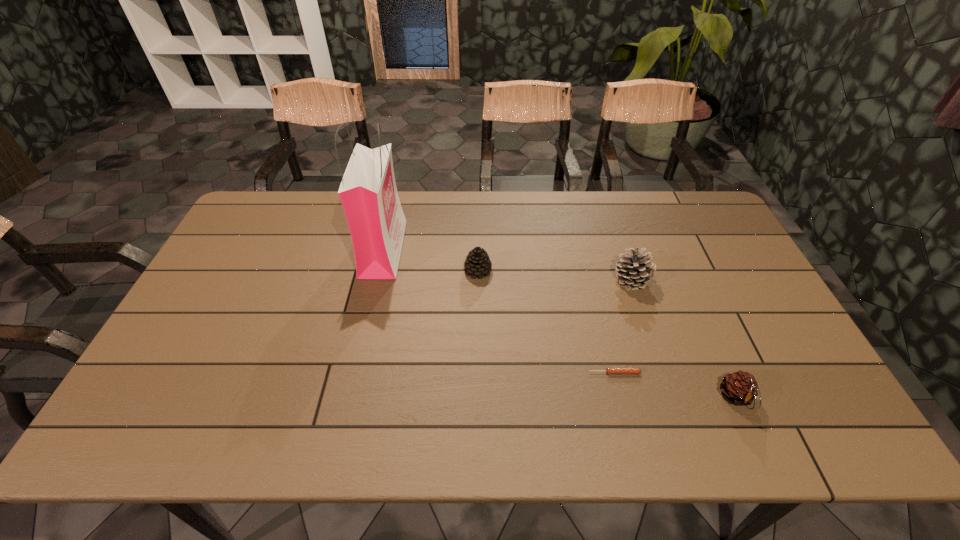
The height and width of the screenshot is (540, 960). What are the coordinates of `the third closest object to the leftmost pinecone` in the screenshot? It's located at (609, 370).

Select which pinecone appears as the closest to the shopping bag. Please provide its 2D coordinates. Your answer should be formatted as a tuple, i.e. [(x, y)], where the tuple contains the x and y coordinates of a point satisfying the conditions above.

[(477, 264)]

Identify which pinecone is located as the nearest to the leftmost pinecone. Please provide its 2D coordinates. Your answer should be formatted as a tuple, i.e. [(x, y)], where the tuple contains the x and y coordinates of a point satisfying the conditions above.

[(634, 269)]

Locate an element on the screen. The width and height of the screenshot is (960, 540). free spot that satisfies the following two spatial constraints: 1. at the narrow end of the fourth object from right to left; 2. on the left side of the second nearest object is located at coordinates (477, 373).

At what (x,y) coordinates should I click in order to perform the action: click on vacant space that satisfies the following two spatial constraints: 1. on the front-facing side of the sausage; 2. on the right side of the shopping bag. Please return your answer as a coordinate pair (x, y). Looking at the image, I should click on (355, 373).

This screenshot has width=960, height=540. In order to click on blank area in the image that satisfies the following two spatial constraints: 1. on the front-facing side of the tallest pinecone; 2. on the left side of the tallest object in this screenshot , I will do `click(376, 280)`.

The image size is (960, 540). Find the location of `free region that satisfies the following two spatial constraints: 1. on the front-facing side of the leftmost object; 2. on the back side of the second pinecone from left to right`. free region that satisfies the following two spatial constraints: 1. on the front-facing side of the leftmost object; 2. on the back side of the second pinecone from left to right is located at coordinates (376, 280).

Locate an element on the screen. The height and width of the screenshot is (540, 960). vacant space that satisfies the following two spatial constraints: 1. at the narrow end of the leftmost pinecone; 2. on the back side of the tallest pinecone is located at coordinates (478, 280).

Identify the location of free region that satisfies the following two spatial constraints: 1. at the narrow end of the tallest pinecone; 2. on the left side of the leftmost pinecone. (478, 280).

This screenshot has width=960, height=540. I want to click on free space that satisfies the following two spatial constraints: 1. on the back side of the fourth shortest object; 2. at the narrow end of the fourth object from right to left, so click(629, 271).